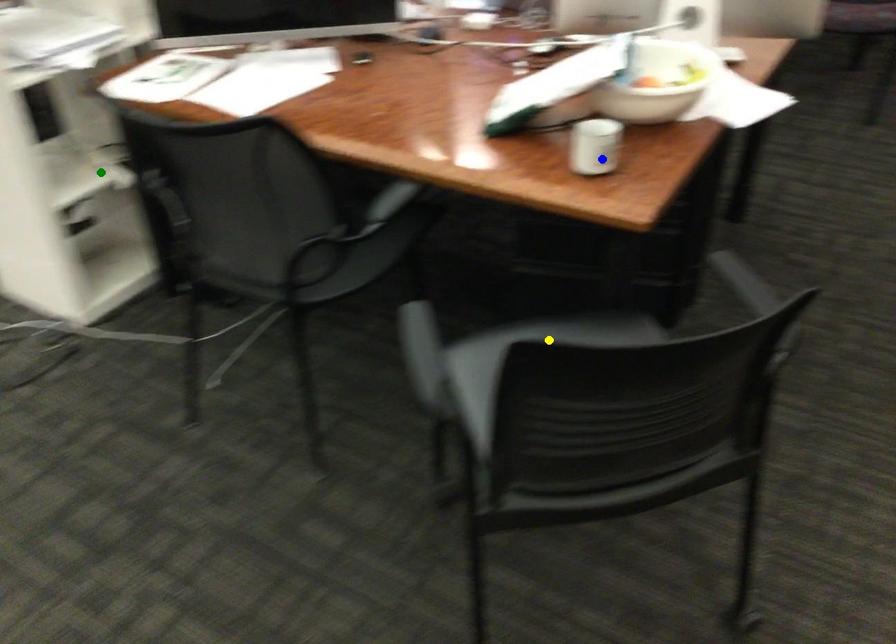
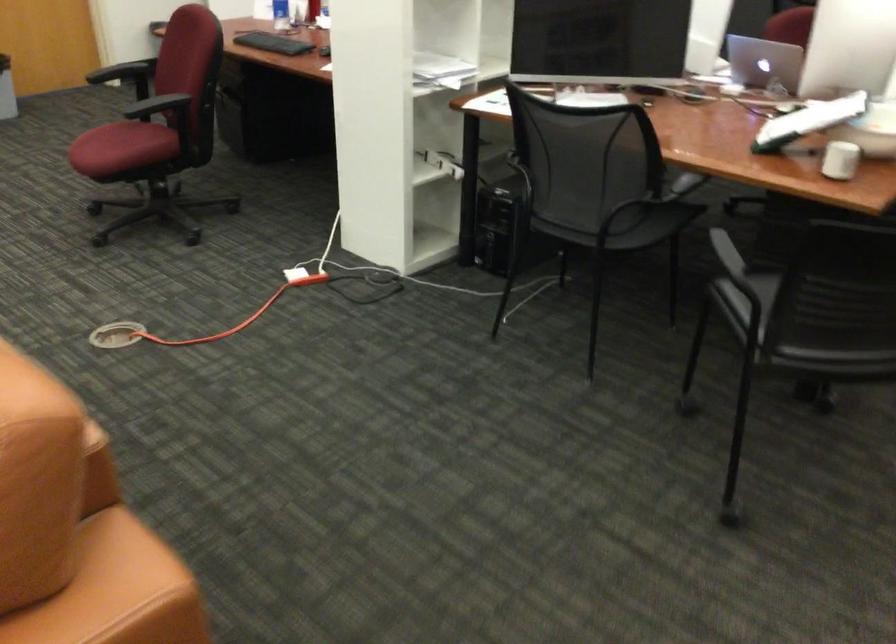
I am providing you with two images of the same scene from different viewpoints. Three points are marked in image1. Which point corresponds to a part or object that is occluded in image2?In image1, three points are marked. Which of them correspond to a part or object that is occluded in image2?Among the three points shown in image1, which one corresponds to a part or object that is no longer visible due to occlusion in image2?

Invisible in image2: yellow point.